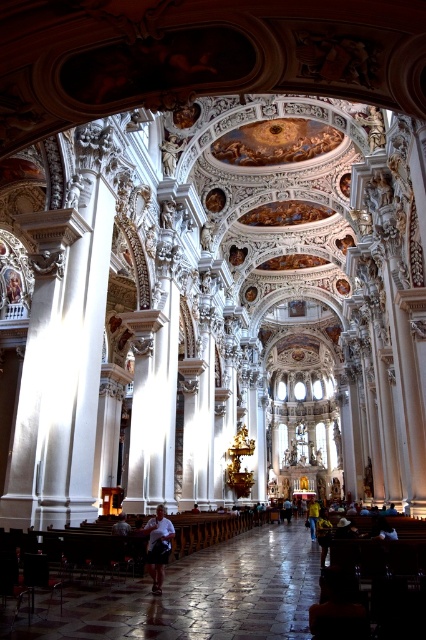
Question: Is white matte shirt at center above light brown leather jacket at center?

Choices:
 (A) no
 (B) yes

Answer: (B)

Question: Which point is farther from the camera taking this photo?

Choices:
 (A) (290, 518)
 (B) (152, 524)
 (C) (313, 534)

Answer: (A)

Question: Among these objects, which one is farthest from the camera?

Choices:
 (A) yellow shirt at center
 (B) light brown leather jacket at center
 (C) white matte shirt at center

Answer: (B)

Question: Does white matte shirt at center appear on the right side of yellow shirt at center?

Choices:
 (A) yes
 (B) no

Answer: (B)

Question: Can you confirm if white matte shirt at center is positioned above light brown leather jacket at center?

Choices:
 (A) yes
 (B) no

Answer: (A)

Question: Which point is closer to the camera?

Choices:
 (A) yellow shirt at center
 (B) light brown leather jacket at center

Answer: (A)